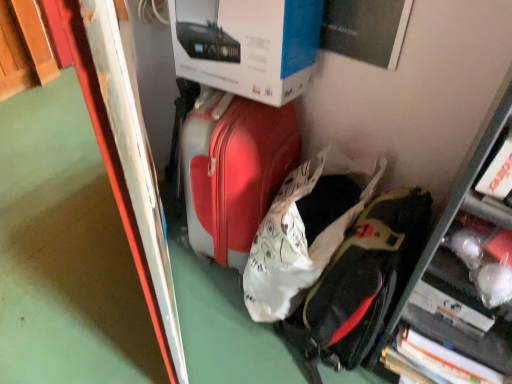
Question: In terms of width, does white cardboard box at upper center look wider or thinner when compared to black matte backpack at lower right?

Choices:
 (A) thin
 (B) wide

Answer: (A)

Question: In terms of height, does white cardboard box at upper center look taller or shorter compared to black matte backpack at lower right?

Choices:
 (A) tall
 (B) short

Answer: (B)

Question: Based on their relative distances, which object is nearer to the black matte backpack at lower right?

Choices:
 (A) matte red suitcase at center
 (B) metallic silver bulletin board at left
 (C) white cardboard box at upper center

Answer: (A)

Question: Based on their relative distances, which object is farther from the matte red suitcase at center?

Choices:
 (A) white cardboard box at upper center
 (B) black matte backpack at lower right
 (C) metallic silver bulletin board at left

Answer: (C)